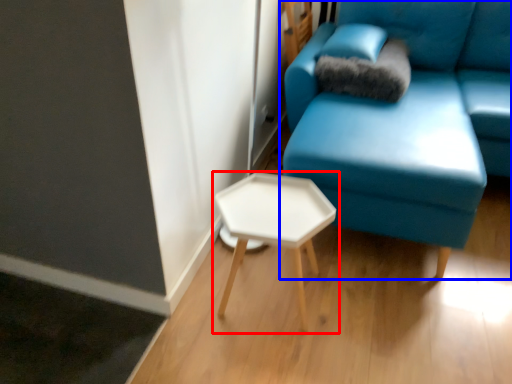
Question: Among these objects, which one is farthest to the camera, table (highlighted by a red box) or studio couch (highlighted by a blue box)?

Choices:
 (A) table
 (B) studio couch

Answer: (A)